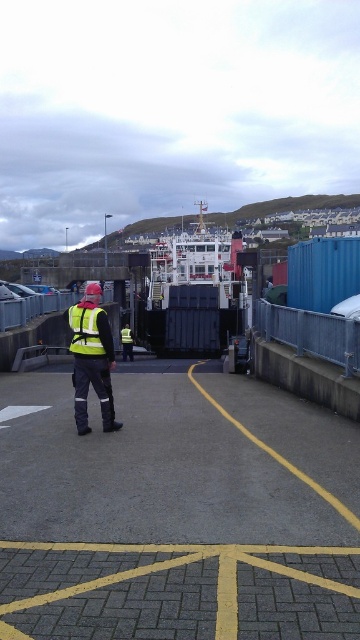
You are standing at the ferry terminal and want to know which of the two points, point (x=88, y=333) or point (x=78, y=301), is closer to you. Can you determine this based on the scene?

Point (x=88, y=333) is closer to the viewer than point (x=78, y=301).